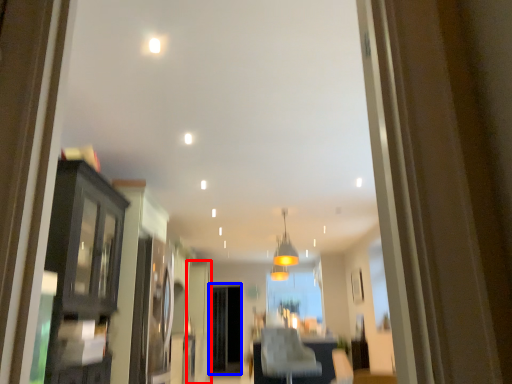
Question: Among these objects, which one is nearest to the camera, door (highlighted by a red box) or screen door (highlighted by a blue box)?

Choices:
 (A) door
 (B) screen door

Answer: (A)